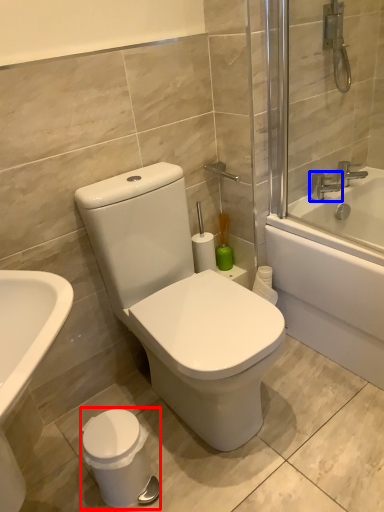
Question: Which object is further to the camera taking this photo, porcelain (highlighted by a red box) or tap (highlighted by a blue box)?

Choices:
 (A) porcelain
 (B) tap

Answer: (B)